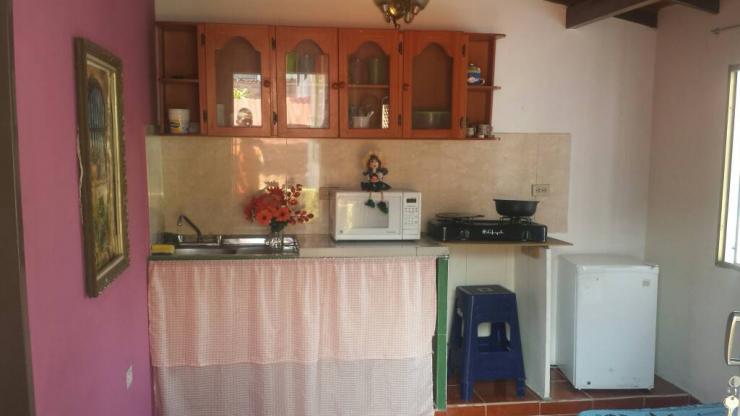
The height and width of the screenshot is (416, 740). I want to click on doors, so click(226, 74), click(299, 95), click(357, 97), click(425, 89).